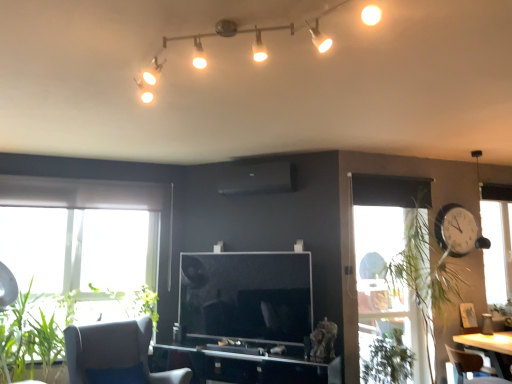
Question: Considering the relative positions of green leafy plant at lower left, which is the second plant from left to right, and green leafy plant at right, which ranks as the 4th plant in left-to-right order, in the image provided, is green leafy plant at lower left, which is the second plant from left to right, behind green leafy plant at right, which ranks as the 4th plant in left-to-right order,?

Choices:
 (A) yes
 (B) no

Answer: (B)

Question: Can you confirm if green leafy plant at lower left, which is the 3th plant from right to left, is bigger than green leafy plant at right, arranged as the first plant when viewed from the right?

Choices:
 (A) yes
 (B) no

Answer: (B)

Question: From the image's perspective, is green leafy plant at lower left, which is the 3th plant from right to left, below green leafy plant at right, which ranks as the 4th plant in left-to-right order?

Choices:
 (A) no
 (B) yes

Answer: (B)

Question: From a real-world perspective, is green leafy plant at lower left, which is the 3th plant from right to left, under green leafy plant at right, which ranks as the 4th plant in left-to-right order?

Choices:
 (A) yes
 (B) no

Answer: (A)

Question: Does green leafy plant at lower left, which is the second plant from left to right, have a lesser width compared to green leafy plant at right, arranged as the first plant when viewed from the right?

Choices:
 (A) no
 (B) yes

Answer: (A)

Question: From the image's perspective, does green leafy plant at lower left, which is the second plant from left to right, appear higher than green leafy plant at right, which ranks as the 4th plant in left-to-right order?

Choices:
 (A) yes
 (B) no

Answer: (B)

Question: Does matte white track lights at upper center come in front of brown leather chair at lower right, the second chair from the left?

Choices:
 (A) yes
 (B) no

Answer: (A)

Question: From the image's perspective, is matte white track lights at upper center above brown leather chair at lower right, the second chair from the left?

Choices:
 (A) no
 (B) yes

Answer: (B)

Question: Is matte white track lights at upper center beside brown leather chair at lower right, the second chair from the left?

Choices:
 (A) yes
 (B) no

Answer: (B)

Question: Considering the relative sizes of matte white track lights at upper center and brown leather chair at lower right, which is the 1th chair in right-to-left order, in the image provided, is matte white track lights at upper center wider than brown leather chair at lower right, which is the 1th chair in right-to-left order,?

Choices:
 (A) yes
 (B) no

Answer: (B)

Question: Is matte white track lights at upper center positioned with its back to brown leather chair at lower right, the second chair from the left?

Choices:
 (A) yes
 (B) no

Answer: (B)

Question: Is matte white track lights at upper center at the left side of brown leather chair at lower right, which is the 1th chair in right-to-left order?

Choices:
 (A) no
 (B) yes

Answer: (B)

Question: Is transparent glass computer desk at center bigger than matte white track lights at upper center?

Choices:
 (A) no
 (B) yes

Answer: (B)